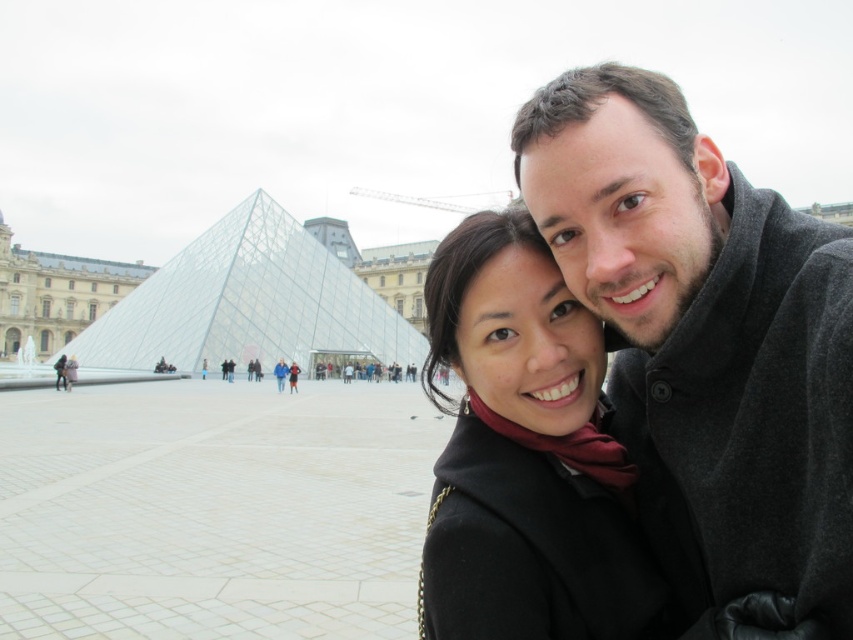
You are a photographer trying to capture the entire Louvre Museum pyramid in your shot. You notice the dark gray wool coat at upper right and the transparent glass pyramid at center. Which object takes up more space in the image?

The transparent glass pyramid at center takes up more space in the image than the dark gray wool coat at upper right because the dark gray wool coat at upper right occupies less space than transparent glass pyramid at center.

You are standing at the Louvre Museum and want to take a photo of the glass pyramid. There are two points marked on your map at coordinates point (x=653, y=196) and point (x=498, y=225). Which point should you stand at to ensure the glass pyramid is fully visible without any obstruction from the couple?

You should stand at point (x=653, y=196) because it is in front of point (x=498, y=225), which means it offers a clearer view of the glass pyramid without obstruction from the couple.